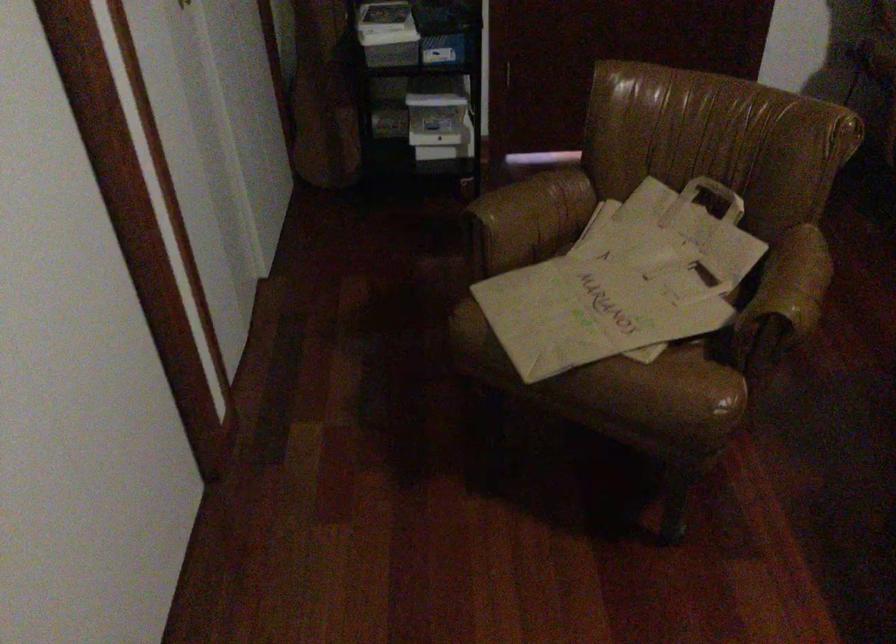
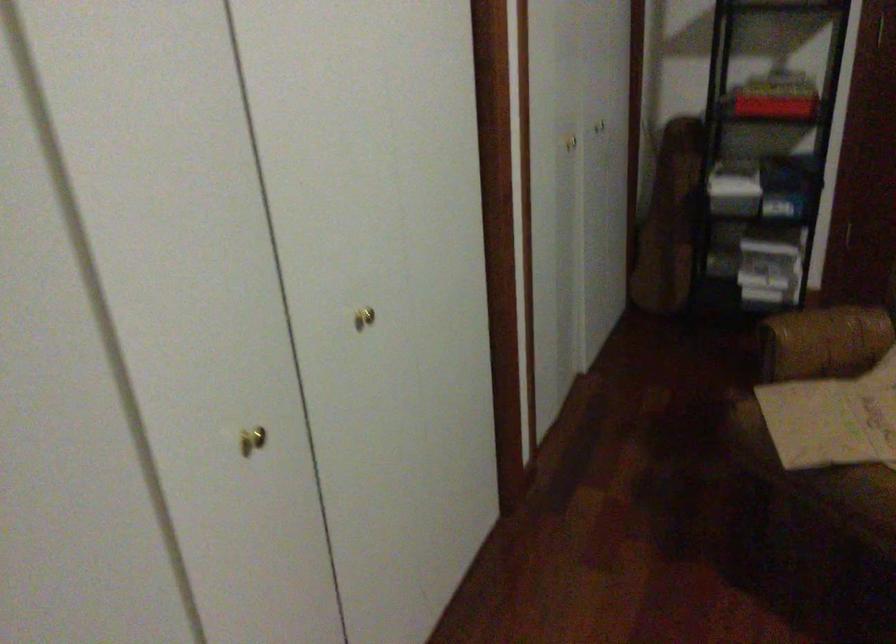
Question: The images are taken continuously from a first-person perspective. In which direction is your viewpoint rotating?

Choices:
 (A) Left
 (B) Right
 (C) Up
 (D) Down

Answer: (A)